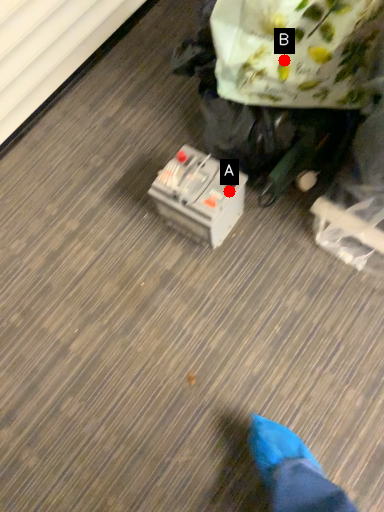
Question: Two points are circled on the image, labeled by A and B beside each circle. Which of the following is the farthest from the observer?

Choices:
 (A) A is further
 (B) B is further

Answer: (A)